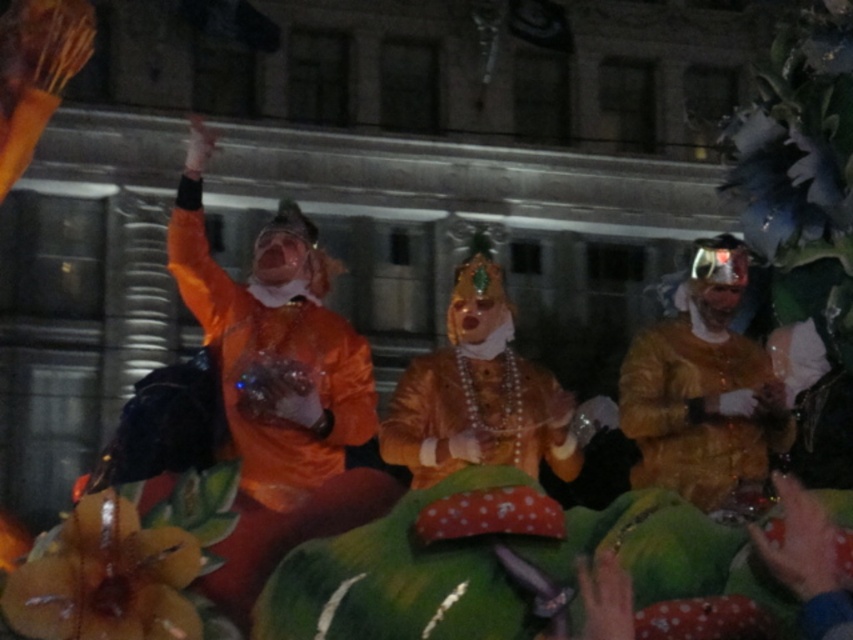
Question: Which point is closer to the camera?

Choices:
 (A) (523, 404)
 (B) (753, 412)

Answer: (B)

Question: From the image, what is the correct spatial relationship of gold satin mask at center in relation to gold shiny fabric at right?

Choices:
 (A) right
 (B) left

Answer: (B)

Question: Which point is closer to the camera?

Choices:
 (A) (476, 291)
 (B) (666, 342)

Answer: (A)

Question: Is gold satin mask at center further to camera compared to gold shiny fabric at right?

Choices:
 (A) yes
 (B) no

Answer: (A)

Question: Is gold satin mask at center below gold shiny fabric at right?

Choices:
 (A) no
 (B) yes

Answer: (A)